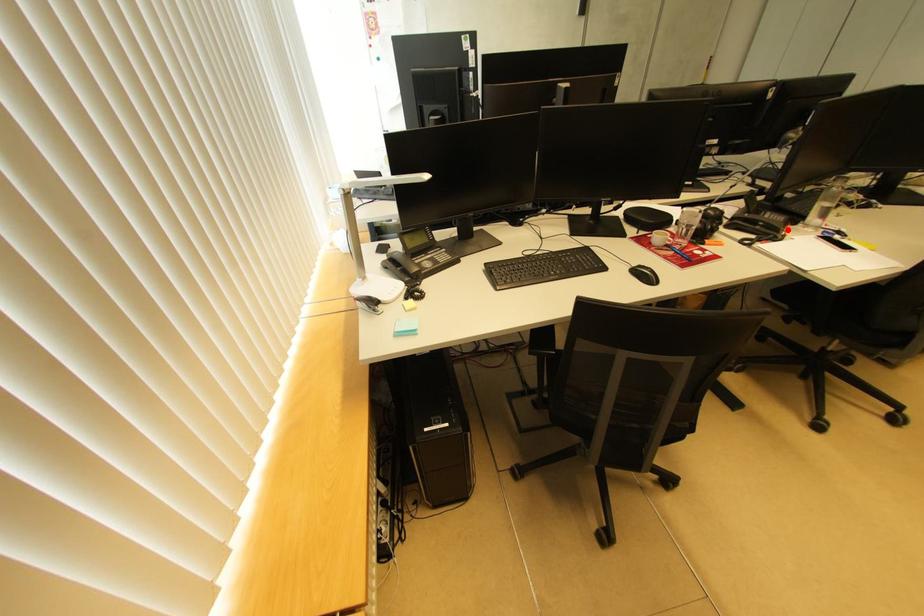
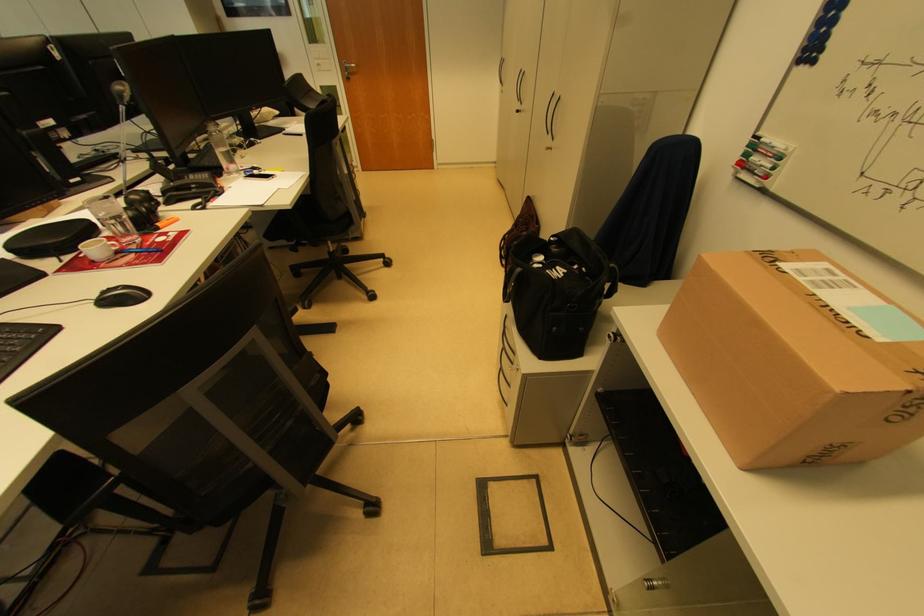
Question: I am providing you with two images of the same scene from different viewpoints. A red point is marked on the first image. Is the red point's position out of view in image 2?

Choices:
 (A) Yes
 (B) No

Answer: (A)